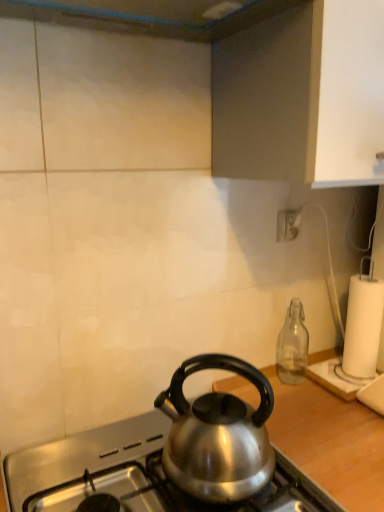
Image resolution: width=384 pixels, height=512 pixels. What do you see at coordinates (363, 325) in the screenshot?
I see `white paper at right` at bounding box center [363, 325].

You are a GUI agent. You are given a task and a screenshot of the screen. Output one action in this format:
    pyautogui.click(x=<x>, y=<y>)
    Task: Click on the satin silver kettle at center
    The height and width of the screenshot is (512, 384).
    Given the screenshot: What is the action you would take?
    pyautogui.click(x=217, y=435)

Locate an element on the screen. This screenshot has height=512, width=384. transparent glass bottle at right is located at coordinates (292, 345).

At what (x,y) coordinates should I click in order to perform the action: click on shiny metallic kettle at center. Please return your answer as a coordinate pair (x, y). Image resolution: width=384 pixels, height=512 pixels. Looking at the image, I should click on (330, 441).

What do you see at coordinates (288, 224) in the screenshot?
I see `white plastic power outlet at upper right` at bounding box center [288, 224].

Find the location of a particular element. Image resolution: width=384 pixels, height=512 pixels. white paper at right is located at coordinates (363, 325).

From the image's perspective, between satin silver kettle at center and transparent glass bottle at right, which one is located above?

transparent glass bottle at right.

Considering the sizes of satin silver kettle at center and transparent glass bottle at right in the image, is satin silver kettle at center bigger or smaller than transparent glass bottle at right?

In the image, satin silver kettle at center appears to be larger than transparent glass bottle at right.

Based on the photo, is satin silver kettle at center aimed at transparent glass bottle at right?

No, satin silver kettle at center is not facing towards transparent glass bottle at right.

Between satin silver kettle at center and transparent glass bottle at right, which one is positioned behind?

transparent glass bottle at right is behind.

Considering the positions of points (167, 471) and (358, 314), is point (167, 471) farther from camera compared to point (358, 314)?

No, (167, 471) is closer to viewer.

Is satin silver kettle at center turned away from white paper at right?

satin silver kettle at center does not have its back to white paper at right.

Is satin silver kettle at center shorter than white paper at right?

Yes.

Between satin silver kettle at center and white paper at right, which one appears on the left side from the viewer's perspective?

From the viewer's perspective, satin silver kettle at center appears more on the left side.

Identify the location of gas stove located below the white paper at right (from the image's perspective). (136, 475).

Is white paper at right wider or thinner than satin silver kettle at center?

Clearly, white paper at right has less width compared to satin silver kettle at center.

Considering the sizes of objects white paper at right and satin silver kettle at center in the image provided, who is shorter, white paper at right or satin silver kettle at center?

satin silver kettle at center is shorter.

Looking at this image, who is shorter, satin silver kettle at center or transparent glass bottle at right?

transparent glass bottle at right.

What are the coordinates of `bottle above the satin silver kettle at center (from the image's perspective)` in the screenshot? It's located at (292, 345).

From the image's perspective, does satin silver kettle at center appear higher than transparent glass bottle at right?

No, from the image's perspective, satin silver kettle at center is not above transparent glass bottle at right.

Does point (243, 487) come closer to viewer compared to point (297, 319)?

Yes, it is in front of point (297, 319).

Consider the image. Are transparent glass bottle at right and white paper at right far apart?

No, transparent glass bottle at right is not far from white paper at right.

From the image's perspective, is transparent glass bottle at right below white paper at right?

Yes.

Is transparent glass bottle at right positioned beyond the bounds of white paper at right?

Yes, transparent glass bottle at right is located beyond the bounds of white paper at right.

How many degrees apart are the facing directions of transparent glass bottle at right and white paper at right?

The facing directions of transparent glass bottle at right and white paper at right are 0.00482 degrees apart.

From a real-world perspective, relative to white paper at right, is white plastic power outlet at upper right vertically above or below?

white plastic power outlet at upper right is situated higher than white paper at right in the real world.

Which object is closer to the camera taking this photo, white plastic power outlet at upper right or white paper at right?

white plastic power outlet at upper right is in front.

In the scene shown: Does white plastic power outlet at upper right have a larger size compared to white paper at right?

Actually, white plastic power outlet at upper right might be smaller than white paper at right.

Measure the distance from shiny metallic kettle at center to satin silver kettle at center.

They are 6.92 inches apart.

Considering the relative positions of shiny metallic kettle at center and satin silver kettle at center in the image provided, is shiny metallic kettle at center in front of satin silver kettle at center?

Yes, shiny metallic kettle at center is in front of satin silver kettle at center.

Is shiny metallic kettle at center wider or thinner than satin silver kettle at center?

In the image, shiny metallic kettle at center appears to be wider than satin silver kettle at center.

How different are the orientations of shiny metallic kettle at center and satin silver kettle at center in degrees?

They differ by 40.1 degrees in their facing directions.

You are a GUI agent. You are given a task and a screenshot of the screen. Output one action in this format:
    pyautogui.click(x=<x>, y=<y>)
    Task: Click on the gas stove below the transparent glass bottle at right (from a real-world perspective)
    
    Given the screenshot: What is the action you would take?
    [x=136, y=475]

Locate an element on the screen. kettle located below the white paper at right (from the image's perspective) is located at coordinates (217, 435).

Which object lies further to the anchor point white paper at right, transparent glass bottle at right or shiny metallic kettle at center?

shiny metallic kettle at center.

Estimate the real-world distances between objects in this image. Which object is closer to white plastic power outlet at upper right, shiny metallic kettle at center or satin silver kettle at center?

The object closer to white plastic power outlet at upper right is shiny metallic kettle at center.

Which object lies further to the anchor point white paper at right, transparent glass bottle at right or satin silver kettle at center?

Based on the image, satin silver kettle at center appears to be further to white paper at right.

When comparing their distances from transparent glass bottle at right, does shiny metallic kettle at center or white plastic power outlet at upper right seem closer?

The object closer to transparent glass bottle at right is shiny metallic kettle at center.

Based on the photo, looking at the image, which one is located closer to white plastic power outlet at upper right, white paper at right or shiny metallic kettle at center?

white paper at right.

From the image, which object appears to be farther from satin silver kettle at center, white paper at right or satin silver kettle at center?

The object further to satin silver kettle at center is white paper at right.

Considering their positions, is shiny metallic kettle at center positioned further to satin silver kettle at center than white paper at right?

Among the two, white paper at right is located further to satin silver kettle at center.

Estimate the real-world distances between objects in this image. Which object is closer to shiny metallic kettle at center, satin silver kettle at center or white paper at right?

satin silver kettle at center is closer to shiny metallic kettle at center.

Find the location of a particular element. This screenshot has height=512, width=384. kettle located between shiny metallic kettle at center and transparent glass bottle at right in the depth direction is located at coordinates (217, 435).

Where is `bottle between satin silver kettle at center and white plastic power outlet at upper right along the z-axis`? bottle between satin silver kettle at center and white plastic power outlet at upper right along the z-axis is located at coordinates click(x=292, y=345).

Find the location of a particular element. Image resolution: width=384 pixels, height=512 pixels. paper towel that lies between white plastic power outlet at upper right and transparent glass bottle at right from top to bottom is located at coordinates (363, 325).

Locate an element on the screen. The image size is (384, 512). kettle positioned between satin silver kettle at center and transparent glass bottle at right from near to far is located at coordinates (217, 435).